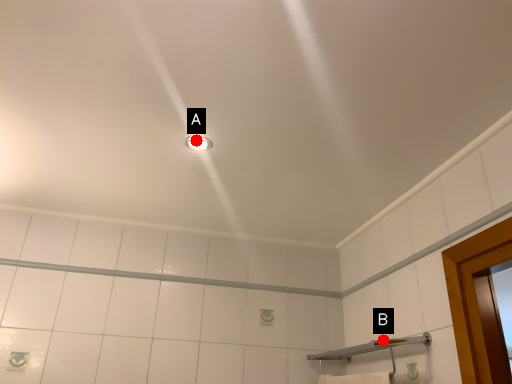
Question: Two points are circled on the image, labeled by A and B beside each circle. Which point appears closest to the camera in this image?

Choices:
 (A) A is closer
 (B) B is closer

Answer: (A)